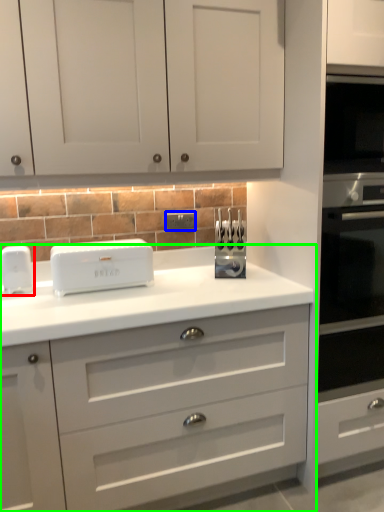
Question: Which object is positioned closest to home appliance (highlighted by a red box)? Select from electric outlet (highlighted by a blue box) and chest of drawers (highlighted by a green box).

Choices:
 (A) electric outlet
 (B) chest of drawers

Answer: (A)